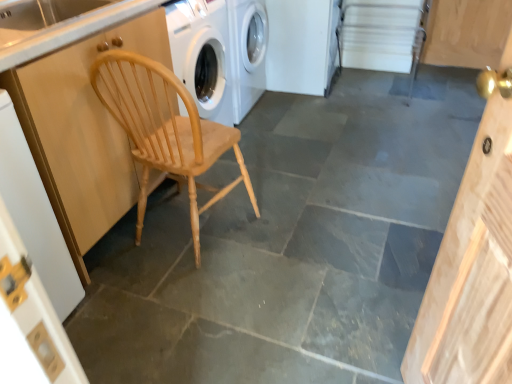
Question: In terms of height, does natural wood cabinet at left look taller or shorter compared to natural wood chair at left?

Choices:
 (A) tall
 (B) short

Answer: (A)

Question: Based on their positions, is natural wood cabinet at left located to the left or right of natural wood chair at left?

Choices:
 (A) left
 (B) right

Answer: (A)

Question: Estimate the real-world distances between objects in this image. Which object is farther from the natural wood cabinet at left?

Choices:
 (A) white glossy counter top at upper left
 (B) natural wood chair at left
 (C) wooden door at left

Answer: (C)

Question: Considering the real-world distances, which object is farthest from the natural wood chair at left?

Choices:
 (A) white glossy counter top at upper left
 (B) natural wood cabinet at left
 (C) wooden door at left

Answer: (C)